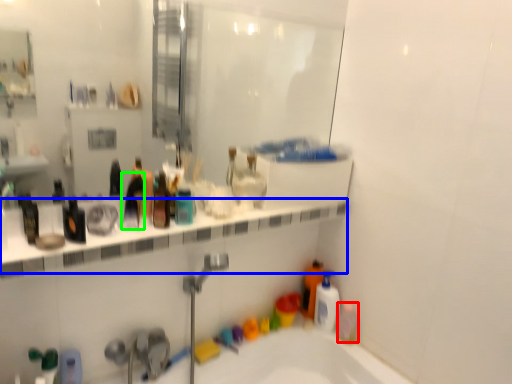
Question: Which object is positioned closest to mouthwash (highlighted by a red box)? Select from ledge (highlighted by a blue box) and toiletry (highlighted by a green box).

Choices:
 (A) ledge
 (B) toiletry

Answer: (A)